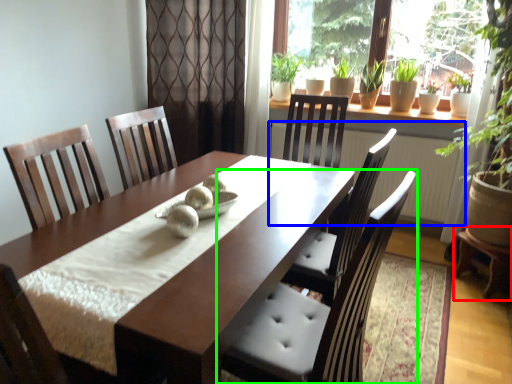
Question: Considering the real-world distances, which object is closest to table (highlighted by a red box)? radiator (highlighted by a blue box) or chair (highlighted by a green box).

Choices:
 (A) radiator
 (B) chair

Answer: (A)